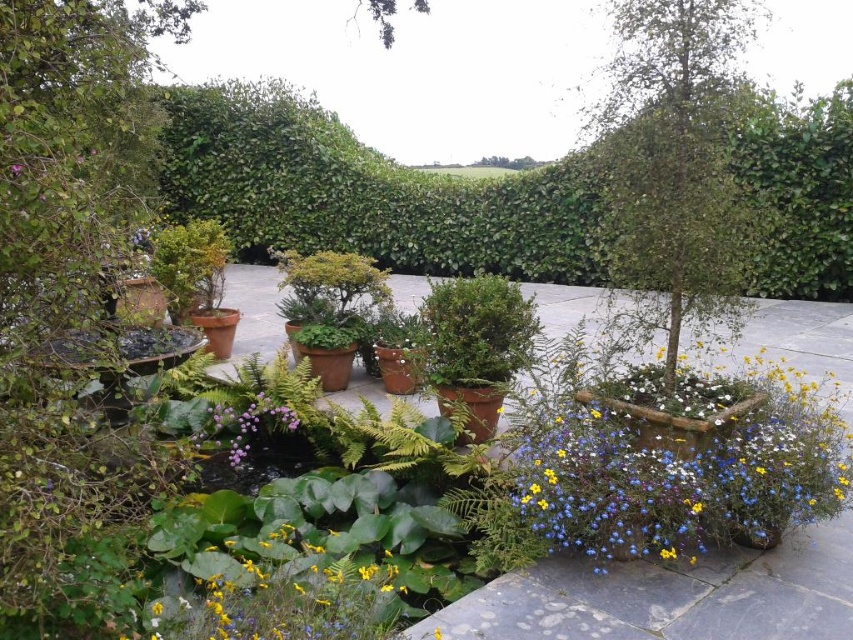
Which of these two, green leafy tree at left or yellow matte flower at center, stands shorter?

Standing shorter between the two is yellow matte flower at center.

Who is taller, green leafy tree at left or yellow matte flower at center?

With more height is green leafy tree at left.

Between point (122, 436) and point (254, 611), which one is positioned in front?

Point (122, 436)

The width and height of the screenshot is (853, 640). What are the coordinates of `green leafy tree at left` in the screenshot? It's located at (73, 305).

Which is more to the right, green leafy tree at left or green leafy tree at center?

green leafy tree at center is more to the right.

Locate an element on the screen. Image resolution: width=853 pixels, height=640 pixels. green leafy tree at left is located at coordinates click(73, 305).

Which is in front, point (561, 240) or point (230, 572)?

Point (230, 572) is in front.

Which is behind, point (820, 192) or point (271, 598)?

Positioned behind is point (820, 192).

You are a GUI agent. You are given a task and a screenshot of the screen. Output one action in this format:
    pyautogui.click(x=<x>, y=<y>)
    Task: Click on the green leafy hedge at upper center
    Image resolution: width=853 pixels, height=640 pixels.
    Given the screenshot: What is the action you would take?
    pyautogui.click(x=366, y=193)